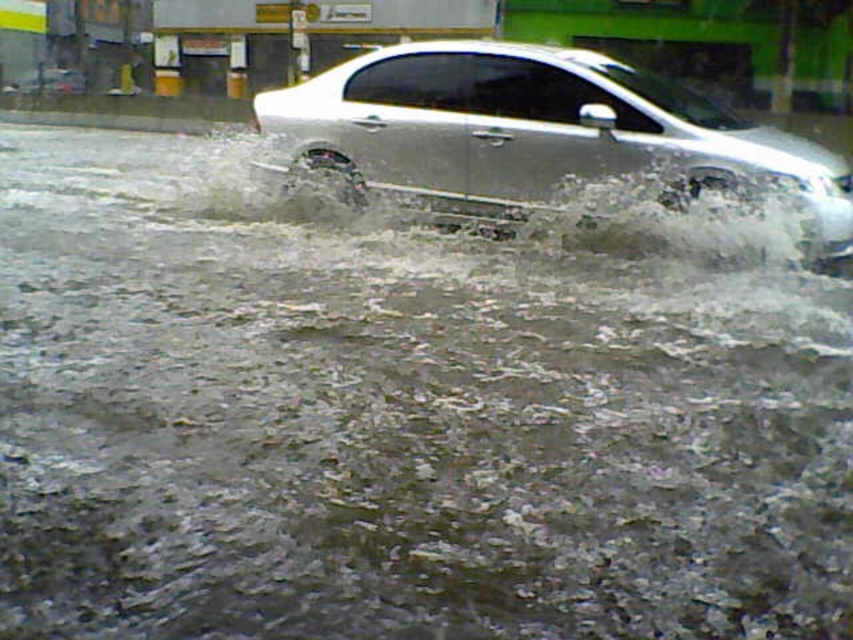
Is point (349, 84) closer to camera compared to point (39, 81)?

Yes, it is in front of point (39, 81).

Can you confirm if silver metallic car at center is wider than satin silver sedan at center?

Indeed, silver metallic car at center has a greater width compared to satin silver sedan at center.

Where is `silver metallic car at center`? silver metallic car at center is located at coordinates (537, 125).